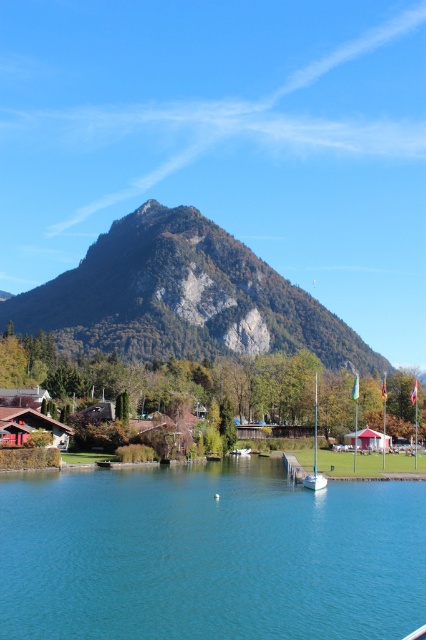
Does teal water at center have a larger size compared to white glossy sailboat at center?

Indeed, teal water at center has a larger size compared to white glossy sailboat at center.

Can you confirm if teal water at center is positioned to the left of white glossy sailboat at center?

Correct, you'll find teal water at center to the left of white glossy sailboat at center.

I want to click on teal water at center, so click(209, 554).

Is rugged stone mountain at center positioned in front of white glossy sailboat at center?

No, rugged stone mountain at center is behind white glossy sailboat at center.

Is point (28, 308) in front of point (316, 486)?

No, (28, 308) is behind (316, 486).

You are a GUI agent. You are given a task and a screenshot of the screen. Output one action in this format:
    pyautogui.click(x=<x>, y=<y>)
    Task: Click on the rugged stone mountain at center
    The width and height of the screenshot is (426, 640).
    Given the screenshot: What is the action you would take?
    pyautogui.click(x=181, y=298)

This screenshot has width=426, height=640. Describe the element at coordinates (209, 554) in the screenshot. I see `teal water at center` at that location.

Who is taller, teal water at center or rugged stone mountain at center?

rugged stone mountain at center is taller.

The image size is (426, 640). Find the location of `teal water at center`. teal water at center is located at coordinates (209, 554).